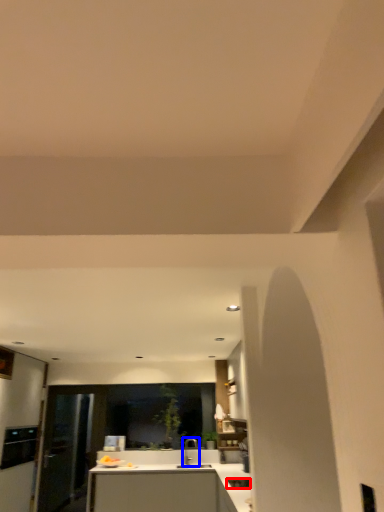
Question: Which object appears farthest to the camera in this image, appliance (highlighted by a red box) or tap (highlighted by a blue box)?

Choices:
 (A) appliance
 (B) tap

Answer: (B)